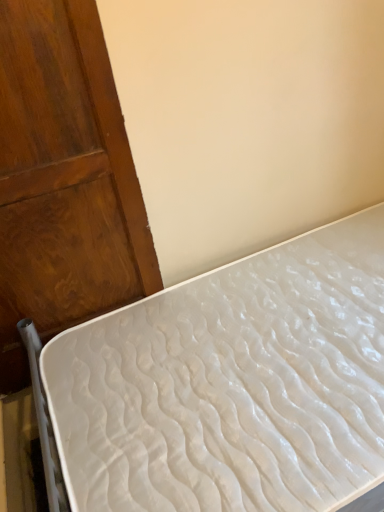
Question: Considering the positions of wooden door at left and white textured mattress at lower right in the image, is wooden door at left taller or shorter than white textured mattress at lower right?

Choices:
 (A) tall
 (B) short

Answer: (A)

Question: From a real-world perspective, is wooden door at left positioned above or below white textured mattress at lower right?

Choices:
 (A) above
 (B) below

Answer: (A)

Question: From the image's perspective, is wooden door at left positioned above or below white textured mattress at lower right?

Choices:
 (A) below
 (B) above

Answer: (B)

Question: In terms of size, does white textured mattress at lower right appear bigger or smaller than wooden door at left?

Choices:
 (A) small
 (B) big

Answer: (B)

Question: From a real-world perspective, is white textured mattress at lower right physically located above or below wooden door at left?

Choices:
 (A) below
 (B) above

Answer: (A)

Question: From the image's perspective, is white textured mattress at lower right above or below wooden door at left?

Choices:
 (A) above
 (B) below

Answer: (B)

Question: Is point (125, 321) positioned closer to the camera than point (109, 76)?

Choices:
 (A) farther
 (B) closer

Answer: (A)